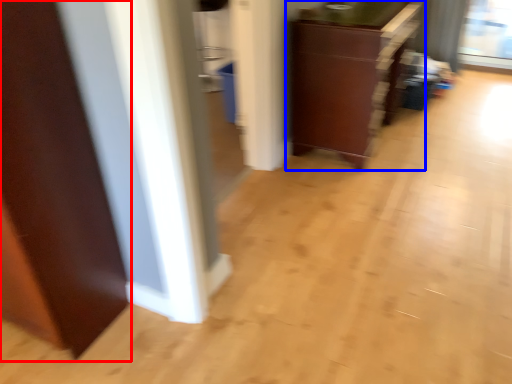
Question: Among these objects, which one is nearest to the camera, door (highlighted by a red box) or cabinetry (highlighted by a blue box)?

Choices:
 (A) door
 (B) cabinetry

Answer: (A)